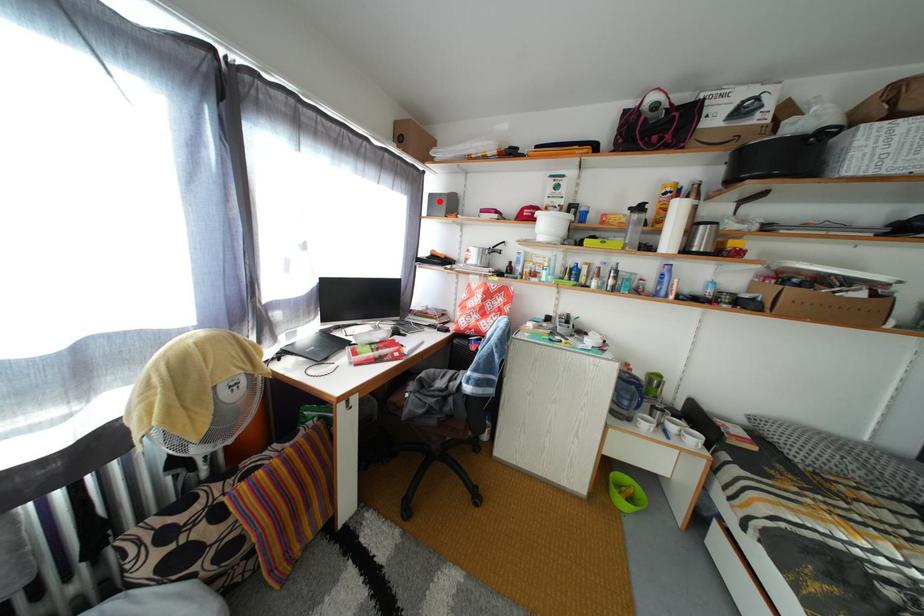
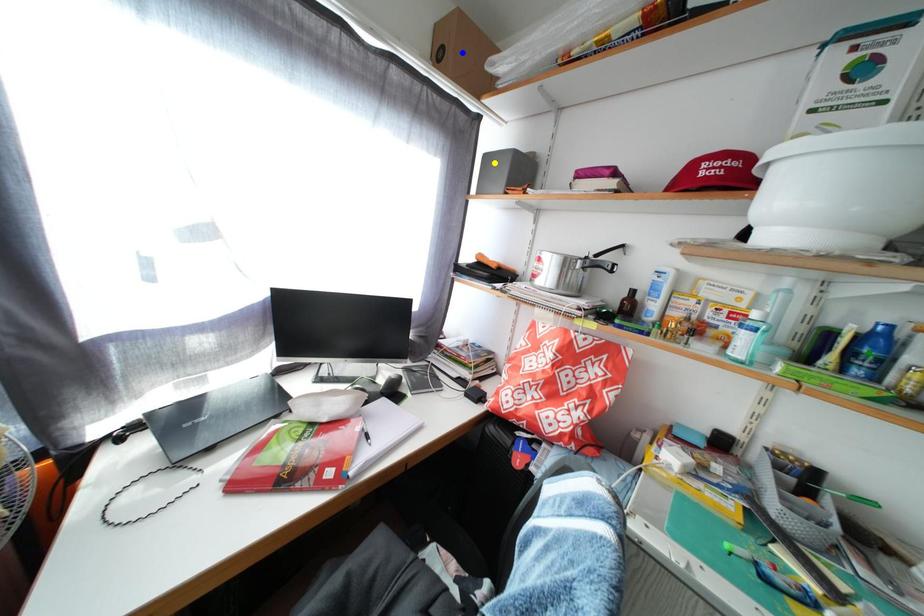
Question: I am providing you with two images of the same scene from different viewpoints. A red point is marked on the first image. You are given multiple points on the second image. Which mark in image 2 goes with the point in image 1?

Choices:
 (A) yellow point
 (B) blue point
 (C) green point

Answer: (A)